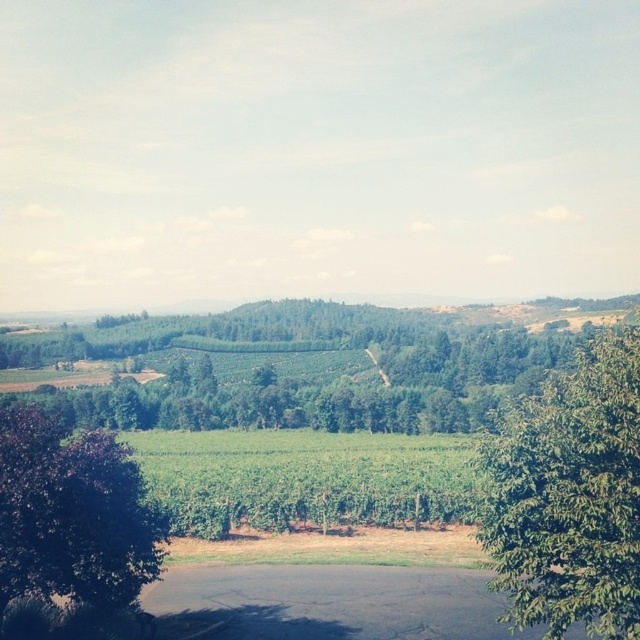
Question: Considering the real-world distances, which object is farthest from the green leafy tree at center-right?

Choices:
 (A) purple leafy tree at left
 (B) green leafy trees at center

Answer: (B)

Question: Which object is the closest to the purple leafy tree at left?

Choices:
 (A) green leafy trees at center
 (B) green leafy field at center
 (C) green leafy tree at center-right

Answer: (C)

Question: Is green leafy trees at center positioned behind green leafy field at center?

Choices:
 (A) yes
 (B) no

Answer: (A)

Question: Which point is farther to the camera?

Choices:
 (A) (88, 516)
 (B) (504, 392)

Answer: (B)

Question: Is green leafy trees at center above green leafy tree at center-right?

Choices:
 (A) no
 (B) yes

Answer: (A)

Question: Is green leafy trees at center in front of purple leafy tree at left?

Choices:
 (A) yes
 (B) no

Answer: (B)